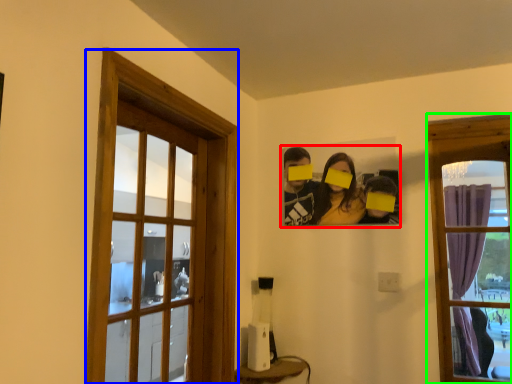
Question: Considering the real-world distances, which object is farthest from couple (highlighted by a red box)? window (highlighted by a blue box) or window (highlighted by a green box)?

Choices:
 (A) window
 (B) window

Answer: (A)